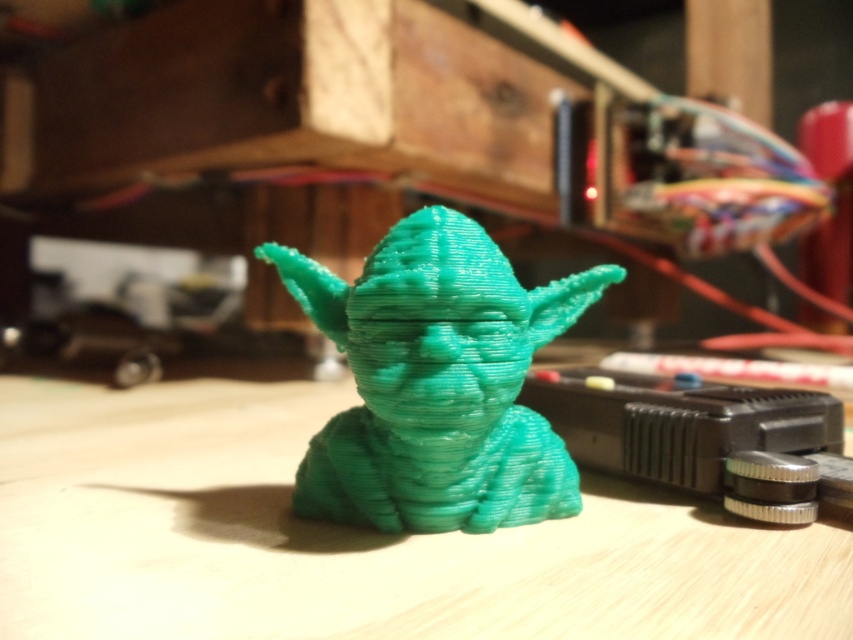
Is green matte plastic yoda at center below teal matte yoda head at center?

Indeed, green matte plastic yoda at center is positioned under teal matte yoda head at center.

Where is `green matte plastic yoda at center`? This screenshot has height=640, width=853. green matte plastic yoda at center is located at coordinates (350, 536).